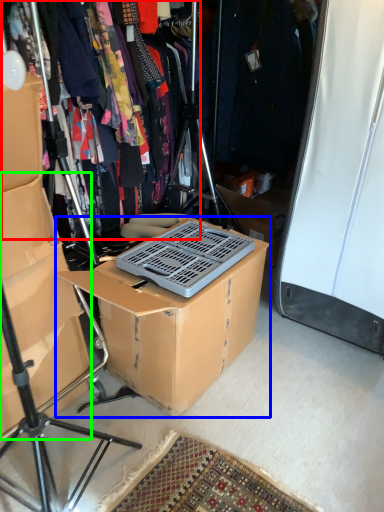
Question: Considering the real-world distances, which object is farthest from clothing (highlighted by a red box)? box (highlighted by a blue box) or storage box (highlighted by a green box)?

Choices:
 (A) box
 (B) storage box

Answer: (A)